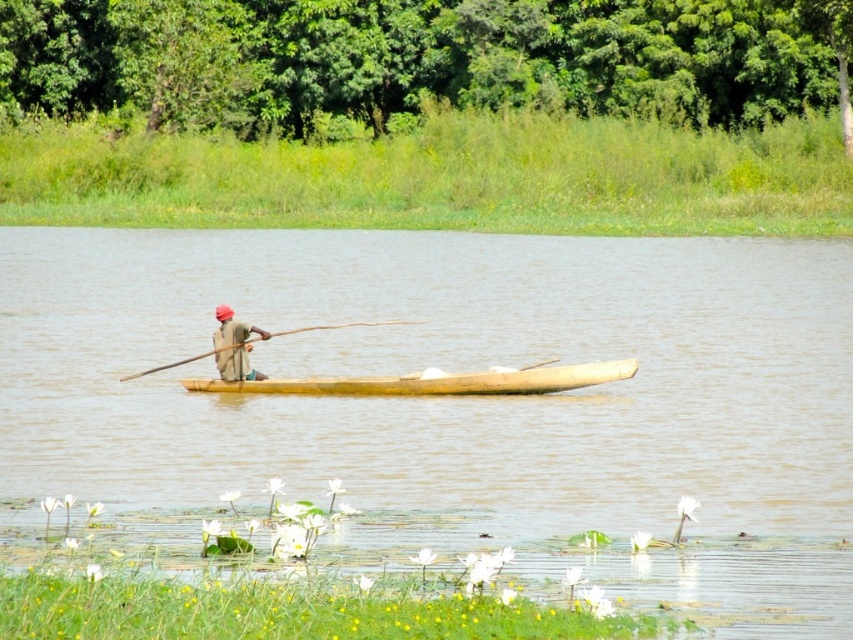
You are a photographer planning to take a photo of the brown wooden boat at center and the wooden at center. Which object should you focus on first if you want to capture both in one frame without moving the camera?

The brown wooden boat at center is larger in size than wooden at center, so you should focus on the brown wooden boat at center first to ensure it is sharp and centered in the frame.

You are a safety inspector checking the distance between the light brown wooden canoe at center and the wooden at center. The safety regulation requires that the distance between any two wooden objects must be at least 2 meters. Is the current distance compliant with the regulation?

The light brown wooden canoe at center and wooden at center are 2.15 meters apart, which exceeds the minimum required distance of 2 meters. Therefore, the current distance is compliant with the safety regulation.

You are standing on the shore and see the light brown wooden canoe at center and the wooden at center in the water. Which object is longer?

The light brown wooden canoe at center is shorter than wooden at center, so the wooden at center is longer.